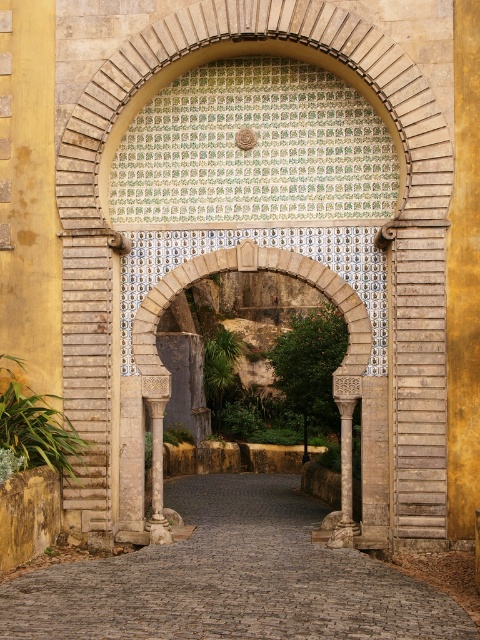
Can you confirm if brown cobblestone path at center is smaller than white stone column at center?

Actually, brown cobblestone path at center might be larger than white stone column at center.

Which of these two, brown cobblestone path at center or white stone column at center, stands shorter?

brown cobblestone path at center

Between point (411, 579) and point (162, 515), which one is positioned behind?

The point (162, 515) is behind.

This screenshot has width=480, height=640. What are the coordinates of `brown cobblestone path at center` in the screenshot? It's located at (231, 580).

Which of these two, brown cobblestone path at center or marble column at center, stands taller?

With more height is marble column at center.

Is brown cobblestone path at center taller than marble column at center?

In fact, brown cobblestone path at center may be shorter than marble column at center.

Between point (241, 612) and point (348, 472), which one is positioned behind?

Positioned behind is point (348, 472).

Locate an element on the screen. brown cobblestone path at center is located at coordinates (231, 580).

Can you confirm if stone archway at center is bigger than marble column at center?

Yes.

Does stone archway at center appear on the right side of marble column at center?

Incorrect, stone archway at center is not on the right side of marble column at center.

This screenshot has height=640, width=480. I want to click on stone archway at center, so click(241, 269).